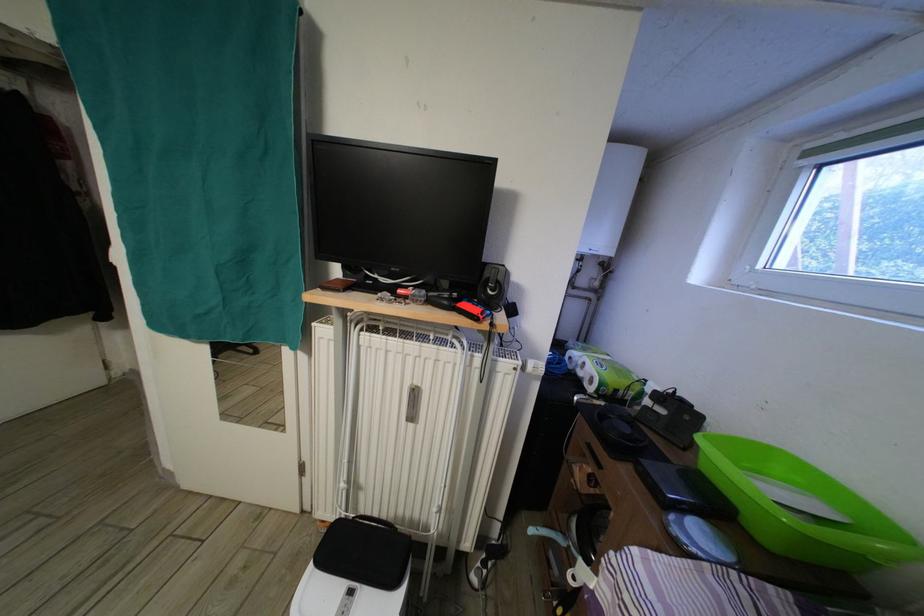
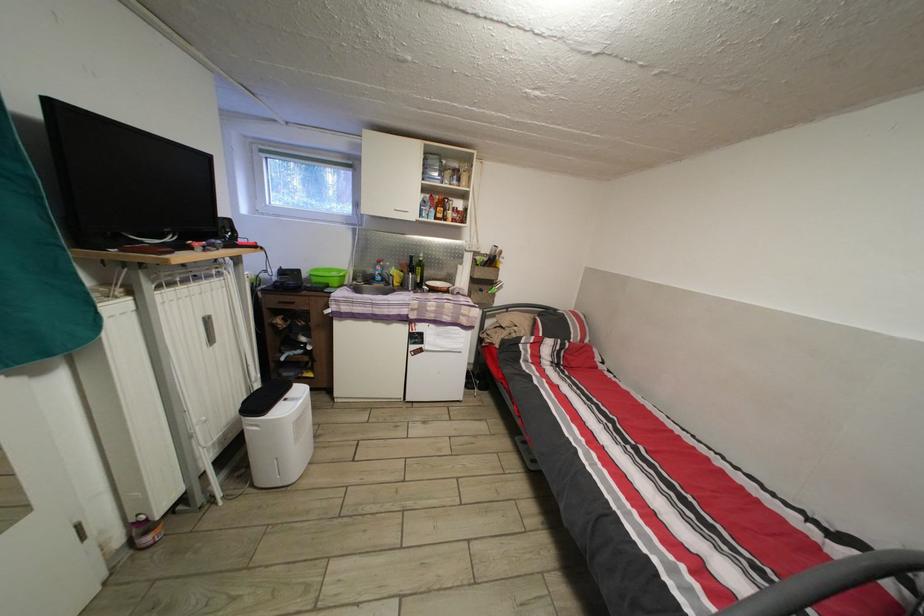
Find the pixel in the second image that matches the point at 815,161 in the first image.

(269, 156)